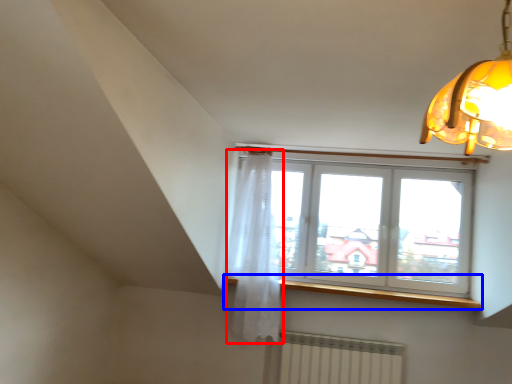
Question: Among these objects, which one is nearest to the camera, curtain (highlighted by a red box) or window sill (highlighted by a blue box)?

Choices:
 (A) curtain
 (B) window sill

Answer: (A)